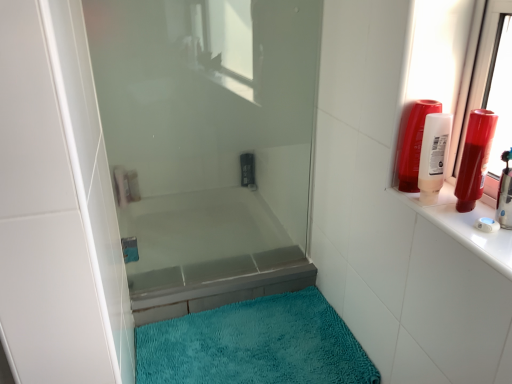
Where is `translucent plastic shampoo bottle at upper right, which is the fourth toiletry from back to front`? translucent plastic shampoo bottle at upper right, which is the fourth toiletry from back to front is located at coordinates (414, 144).

Describe the element at coordinates (121, 185) in the screenshot. I see `matte plastic soap dispenser at upper left, placed as the sixth toiletry when sorted from right to left` at that location.

Locate an element on the screen. Image resolution: width=512 pixels, height=384 pixels. matte white bottle at upper right, placed as the 5th toiletry when sorted from left to right is located at coordinates [x=433, y=155].

You are a GUI agent. You are given a task and a screenshot of the screen. Output one action in this format:
    pyautogui.click(x=<x>, y=<y>)
    Task: Click on the transparent glass shower door at center
    The width and height of the screenshot is (512, 384).
    Given the screenshot: What is the action you would take?
    pyautogui.click(x=209, y=143)

What do you see at coordinates (255, 345) in the screenshot?
I see `teal plush bath mat at lower center` at bounding box center [255, 345].

I want to click on teal plush bath mat at lower center, so click(x=255, y=345).

Find the location of `shiny red tube at upper right, the 6th toiletry from the back`. shiny red tube at upper right, the 6th toiletry from the back is located at coordinates (475, 158).

Which is behind, point (421, 123) or point (128, 193)?

The point (128, 193) is farther from the camera.

From the image's perspective, count 3rd toiletrys upward from the matte plastic soap dispenser at upper left, the 4th toiletry from the front, and point to it. Please provide its 2D coordinates.

[(414, 144)]

Is there a large distance between translucent plastic shampoo bottle at upper right, arranged as the fourth toiletry when viewed from the left, and matte plastic soap dispenser at upper left, placed as the sixth toiletry when sorted from right to left?

translucent plastic shampoo bottle at upper right, arranged as the fourth toiletry when viewed from the left, is actually quite close to matte plastic soap dispenser at upper left, placed as the sixth toiletry when sorted from right to left.

How distant is translucent plastic shampoo bottle at upper right, arranged as the fourth toiletry when viewed from the left, from matte plastic soap dispenser at upper left, placed as the sixth toiletry when sorted from right to left?

A distance of 34.65 inches exists between translucent plastic shampoo bottle at upper right, arranged as the fourth toiletry when viewed from the left, and matte plastic soap dispenser at upper left, placed as the sixth toiletry when sorted from right to left.

From a real-world perspective, which object stands above the other?

In real-world perspective, translucent plastic shampoo bottle at upper right, positioned as the third toiletry in front-to-back order, is above.

Who is shorter, translucent plastic shampoo bottle at upper right, which is the 3th toiletry from right to left, or matte white bottle at upper right, the 2th toiletry in the front-to-back sequence?

Standing shorter between the two is matte white bottle at upper right, the 2th toiletry in the front-to-back sequence.

Would you consider translucent plastic shampoo bottle at upper right, arranged as the fourth toiletry when viewed from the left, to be distant from matte white bottle at upper right, the second toiletry when ordered from right to left?

Actually, translucent plastic shampoo bottle at upper right, arranged as the fourth toiletry when viewed from the left, and matte white bottle at upper right, the second toiletry when ordered from right to left, are a little close together.

How many degrees apart are the facing directions of translucent plastic shampoo bottle at upper right, which is the 3th toiletry from right to left, and matte white bottle at upper right, placed as the 5th toiletry when sorted from left to right?

The angle between the facing direction of translucent plastic shampoo bottle at upper right, which is the 3th toiletry from right to left, and the facing direction of matte white bottle at upper right, placed as the 5th toiletry when sorted from left to right, is 0.0118 degrees.

Find the location of a particular element. The width and height of the screenshot is (512, 384). bath mat that is under the white matte soap dispenser at upper left, arranged as the second toiletry when viewed from the left (from a real-world perspective) is located at coordinates (255, 345).

Between point (225, 311) and point (135, 172), which one is positioned behind?

The point (225, 311) is behind.

Based on the photo, from the image's perspective, is teal plush bath mat at lower center located above or below white matte soap dispenser at upper left, the 2th toiletry positioned from the back?

Clearly, from the image's perspective, teal plush bath mat at lower center is below white matte soap dispenser at upper left, the 2th toiletry positioned from the back.

Can white matte soap dispenser at upper left, acting as the fifth toiletry starting from the front, be found inside teal plush bath mat at lower center?

No, white matte soap dispenser at upper left, acting as the fifth toiletry starting from the front, is not inside teal plush bath mat at lower center.

From the image's perspective, between white matte soap dispenser at upper left, which appears as the 5th toiletry when viewed from the right, and matte black control panel at center, placed as the 1th toiletry when sorted from back to front, which one is located above?

From the image's view, matte black control panel at center, placed as the 1th toiletry when sorted from back to front, is above.

Can you confirm if white matte soap dispenser at upper left, arranged as the second toiletry when viewed from the left, is positioned to the right of matte black control panel at center, which is counted as the fourth toiletry, starting from the right?

No.

Is white matte soap dispenser at upper left, acting as the fifth toiletry starting from the front, taller or shorter than matte black control panel at center, placed as the third toiletry when sorted from left to right?

In the image, white matte soap dispenser at upper left, acting as the fifth toiletry starting from the front, appears to be shorter than matte black control panel at center, placed as the third toiletry when sorted from left to right.

From the picture: Considering the relative positions of white matte soap dispenser at upper left, arranged as the second toiletry when viewed from the left, and matte black control panel at center, placed as the third toiletry when sorted from left to right, in the image provided, is white matte soap dispenser at upper left, arranged as the second toiletry when viewed from the left, behind matte black control panel at center, placed as the third toiletry when sorted from left to right,?

No, the depth of white matte soap dispenser at upper left, arranged as the second toiletry when viewed from the left, is less than that of matte black control panel at center, placed as the third toiletry when sorted from left to right.

Is matte white bottle at upper right, the second toiletry when ordered from right to left, positioned beyond the bounds of matte plastic soap dispenser at upper left, placed as the sixth toiletry when sorted from right to left?

Absolutely, matte white bottle at upper right, the second toiletry when ordered from right to left, is external to matte plastic soap dispenser at upper left, placed as the sixth toiletry when sorted from right to left.

Looking at their sizes, would you say matte white bottle at upper right, the second toiletry when ordered from right to left, is wider or thinner than matte plastic soap dispenser at upper left, the 4th toiletry from the front?

Considering their sizes, matte white bottle at upper right, the second toiletry when ordered from right to left, looks slimmer than matte plastic soap dispenser at upper left, the 4th toiletry from the front.

Could you tell me if matte white bottle at upper right, the 2th toiletry in the front-to-back sequence, is turned towards matte plastic soap dispenser at upper left, the third toiletry in the back-to-front sequence?

No, matte white bottle at upper right, the 2th toiletry in the front-to-back sequence, is not oriented towards matte plastic soap dispenser at upper left, the third toiletry in the back-to-front sequence.

From the image's perspective, is matte white bottle at upper right, the second toiletry when ordered from right to left, below matte plastic soap dispenser at upper left, the 4th toiletry from the front?

No.

Would you say matte white bottle at upper right, which appears as the 5th toiletry when viewed from the back, is outside transparent glass shower door at center?

Absolutely, matte white bottle at upper right, which appears as the 5th toiletry when viewed from the back, is external to transparent glass shower door at center.

Is matte white bottle at upper right, the second toiletry when ordered from right to left, bigger than transparent glass shower door at center?

Incorrect, matte white bottle at upper right, the second toiletry when ordered from right to left, is not larger than transparent glass shower door at center.

From the image's perspective, count 1st toiletrys downward from the transparent glass shower door at center and point to it. Please provide its 2D coordinates.

[(433, 155)]

Between matte white bottle at upper right, the 2th toiletry in the front-to-back sequence, and shiny red tube at upper right, the 6th toiletry from the back, which one is positioned in front?

shiny red tube at upper right, the 6th toiletry from the back, is closer to the camera.

Considering the sizes of matte white bottle at upper right, which appears as the 5th toiletry when viewed from the back, and shiny red tube at upper right, the 6th toiletry from the back, in the image, is matte white bottle at upper right, which appears as the 5th toiletry when viewed from the back, taller or shorter than shiny red tube at upper right, the 6th toiletry from the back,?

Clearly, matte white bottle at upper right, which appears as the 5th toiletry when viewed from the back, is shorter compared to shiny red tube at upper right, the 6th toiletry from the back.

From the image's perspective, which one is positioned lower, matte white bottle at upper right, the 2th toiletry in the front-to-back sequence, or shiny red tube at upper right, the 6th toiletry viewed from the left?

From the image's view, shiny red tube at upper right, the 6th toiletry viewed from the left, is below.

Between matte white bottle at upper right, the 2th toiletry in the front-to-back sequence, and shiny red tube at upper right, the 6th toiletry viewed from the left, which one has larger size?

matte white bottle at upper right, the 2th toiletry in the front-to-back sequence, is bigger.

What are the coordinates of `the 3rd toiletry to the right when counting from the matte plastic soap dispenser at upper left, the 4th toiletry from the front` in the screenshot? It's located at (414, 144).

There is a translucent plastic shampoo bottle at upper right, arranged as the fourth toiletry when viewed from the left. At what (x,y) coordinates should I click in order to perform the action: click on the 1st toiletry below it (from the image's perspective). Please return your answer as a coordinate pair (x, y). The width and height of the screenshot is (512, 384). Looking at the image, I should click on (433, 155).

Estimate the real-world distances between objects in this image. Which object is further from matte plastic soap dispenser at upper left, the third toiletry in the back-to-front sequence, translucent plastic shampoo bottle at upper right, which is the 3th toiletry from right to left, or shiny red tube at upper right, positioned as the 1th toiletry in right-to-left order?

Among the two, shiny red tube at upper right, positioned as the 1th toiletry in right-to-left order, is located further to matte plastic soap dispenser at upper left, the third toiletry in the back-to-front sequence.

Estimate the real-world distances between objects in this image. Which object is further from matte black control panel at center, placed as the third toiletry when sorted from left to right, teal plush bath mat at lower center or matte plastic soap dispenser at upper left, the 4th toiletry from the front?

teal plush bath mat at lower center.

Considering their positions, is white matte soap dispenser at upper left, arranged as the second toiletry when viewed from the left, positioned closer to shiny red tube at upper right, the 6th toiletry from the back, than matte white bottle at upper right, the second toiletry when ordered from right to left?

Based on the image, matte white bottle at upper right, the second toiletry when ordered from right to left, appears to be nearer to shiny red tube at upper right, the 6th toiletry from the back.

Considering their positions, is matte plastic soap dispenser at upper left, the third toiletry in the back-to-front sequence, positioned closer to transparent glass shower door at center than matte black control panel at center, which is counted as the fourth toiletry, starting from the right?

matte plastic soap dispenser at upper left, the third toiletry in the back-to-front sequence, is positioned closer to the anchor transparent glass shower door at center.

From the image, which object appears to be nearer to transparent glass shower door at center, translucent plastic shampoo bottle at upper right, which is the 3th toiletry from right to left, or matte black control panel at center, placed as the third toiletry when sorted from left to right?

matte black control panel at center, placed as the third toiletry when sorted from left to right, is positioned closer to the anchor transparent glass shower door at center.

Estimate the real-world distances between objects in this image. Which object is further from shiny red tube at upper right, positioned as the 1th toiletry in right-to-left order, translucent plastic shampoo bottle at upper right, which is the fourth toiletry from back to front, or transparent glass shower door at center?

Based on the image, transparent glass shower door at center appears to be further to shiny red tube at upper right, positioned as the 1th toiletry in right-to-left order.

When comparing their distances from transparent glass shower door at center, does shiny red tube at upper right, arranged as the 1th toiletry when viewed from the front, or white matte soap dispenser at upper left, acting as the fifth toiletry starting from the front, seem further?

shiny red tube at upper right, arranged as the 1th toiletry when viewed from the front, is further to transparent glass shower door at center.

When comparing their distances from transparent glass shower door at center, does matte black control panel at center, placed as the third toiletry when sorted from left to right, or teal plush bath mat at lower center seem further?

The object further to transparent glass shower door at center is matte black control panel at center, placed as the third toiletry when sorted from left to right.

Where is `shower door between matte white bottle at upper right, which appears as the 5th toiletry when viewed from the back, and matte plastic soap dispenser at upper left, the 4th toiletry from the front, from front to back`? shower door between matte white bottle at upper right, which appears as the 5th toiletry when viewed from the back, and matte plastic soap dispenser at upper left, the 4th toiletry from the front, from front to back is located at coordinates coord(209,143).

This screenshot has height=384, width=512. Find the location of `bath mat positioned between matte white bottle at upper right, the 2th toiletry in the front-to-back sequence, and matte plastic soap dispenser at upper left, the 1th toiletry in the left-to-right sequence, from near to far`. bath mat positioned between matte white bottle at upper right, the 2th toiletry in the front-to-back sequence, and matte plastic soap dispenser at upper left, the 1th toiletry in the left-to-right sequence, from near to far is located at coordinates (255, 345).

Find the location of `bath mat positioned between translucent plastic shampoo bottle at upper right, which is the fourth toiletry from back to front, and white matte soap dispenser at upper left, acting as the fifth toiletry starting from the front, from near to far`. bath mat positioned between translucent plastic shampoo bottle at upper right, which is the fourth toiletry from back to front, and white matte soap dispenser at upper left, acting as the fifth toiletry starting from the front, from near to far is located at coordinates (255, 345).

Identify the location of bath mat located between matte white bottle at upper right, the second toiletry when ordered from right to left, and matte black control panel at center, which is counted as the sixth toiletry, starting from the front, in the depth direction. This screenshot has width=512, height=384. (255, 345).